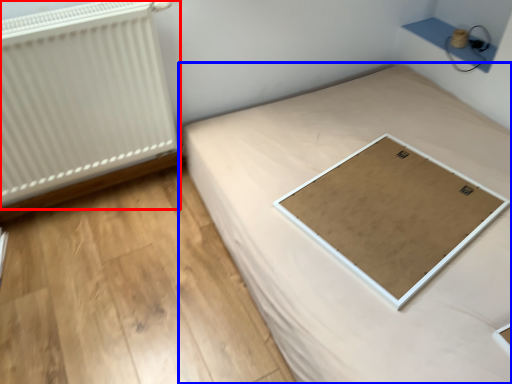
Question: Which of the following is the closest to the observer, radiator (highlighted by a red box) or bed (highlighted by a blue box)?

Choices:
 (A) radiator
 (B) bed

Answer: (B)